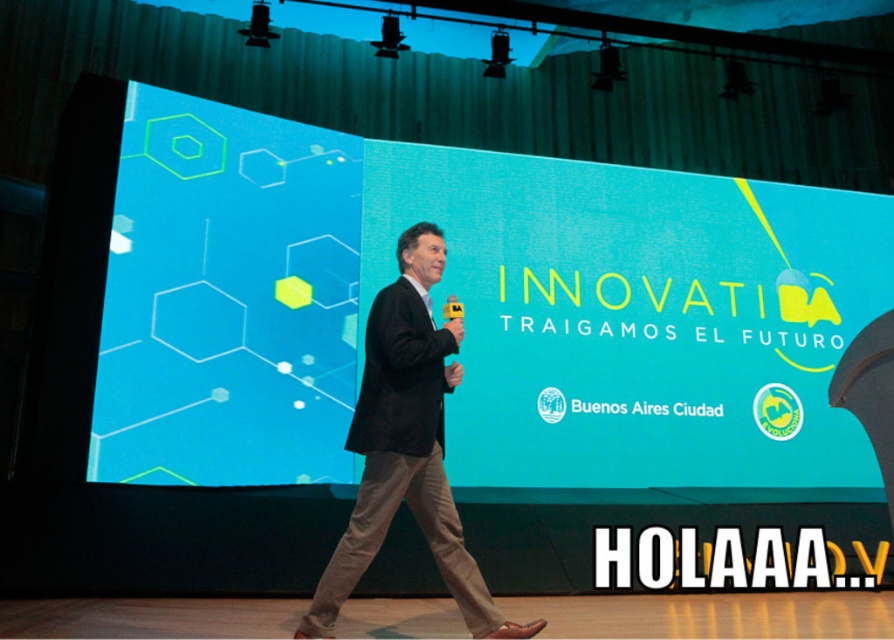
Who is positioned more to the left, blue matte projection screen at center or blue glossy hexagons at upper left?

blue glossy hexagons at upper left

Which is above, blue matte projection screen at center or blue glossy hexagons at upper left?

blue glossy hexagons at upper left

Which is in front, point (367, 289) or point (191, 140)?

Point (191, 140) is more forward.

At what (x,y) coordinates should I click in order to perform the action: click on blue matte projection screen at center. Please return your answer as a coordinate pair (x, y). This screenshot has height=640, width=894. Looking at the image, I should click on (473, 308).

What do you see at coordinates (473, 308) in the screenshot? Image resolution: width=894 pixels, height=640 pixels. I see `blue matte projection screen at center` at bounding box center [473, 308].

Who is lower down, blue matte projection screen at center or black suit at center?

black suit at center

Is point (187, 248) behind point (456, 326)?

Yes, point (187, 248) is behind point (456, 326).

Find the location of a particular element. The image size is (894, 640). blue matte projection screen at center is located at coordinates (473, 308).

Is blue glossy hexagons at upper left further to the viewer compared to black suit at center?

Yes, it is.

What do you see at coordinates (226, 298) in the screenshot? I see `blue glossy hexagons at upper left` at bounding box center [226, 298].

Is point (150, 154) positioned in front of point (308, 620)?

No, (150, 154) is behind (308, 620).

The width and height of the screenshot is (894, 640). Find the location of `blue glossy hexagons at upper left`. blue glossy hexagons at upper left is located at coordinates (226, 298).